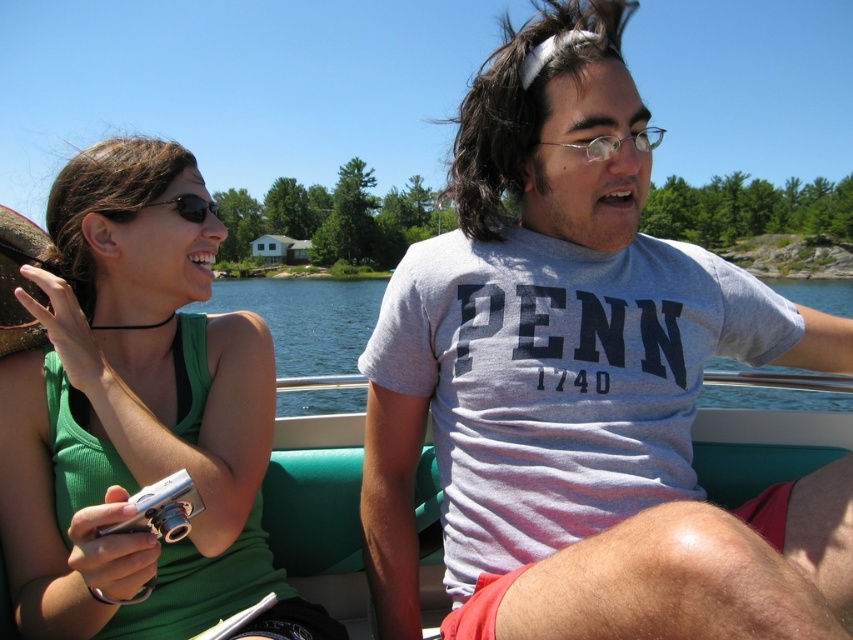
Question: Among these objects, which one is farthest from the camera?

Choices:
 (A) green matte tank top at upper left
 (B) gray cotton t-shirt at center
 (C) black reflective sunglasses at upper left

Answer: (C)

Question: Estimate the real-world distances between objects in this image. Which object is farther from the teal fabric boat at center?

Choices:
 (A) black reflective sunglasses at upper left
 (B) green matte tank top at upper left
 (C) gray cotton t-shirt at center

Answer: (A)

Question: Where is gray cotton t-shirt at center located in relation to teal fabric boat at center in the image?

Choices:
 (A) left
 (B) right

Answer: (A)

Question: Can you confirm if gray cotton t-shirt at center is thinner than green matte tank top at upper left?

Choices:
 (A) no
 (B) yes

Answer: (A)

Question: Can you confirm if teal fabric boat at center is thinner than black reflective sunglasses at upper left?

Choices:
 (A) yes
 (B) no

Answer: (B)

Question: Among these objects, which one is nearest to the camera?

Choices:
 (A) gray cotton t-shirt at center
 (B) teal fabric boat at center
 (C) black reflective sunglasses at upper left

Answer: (A)